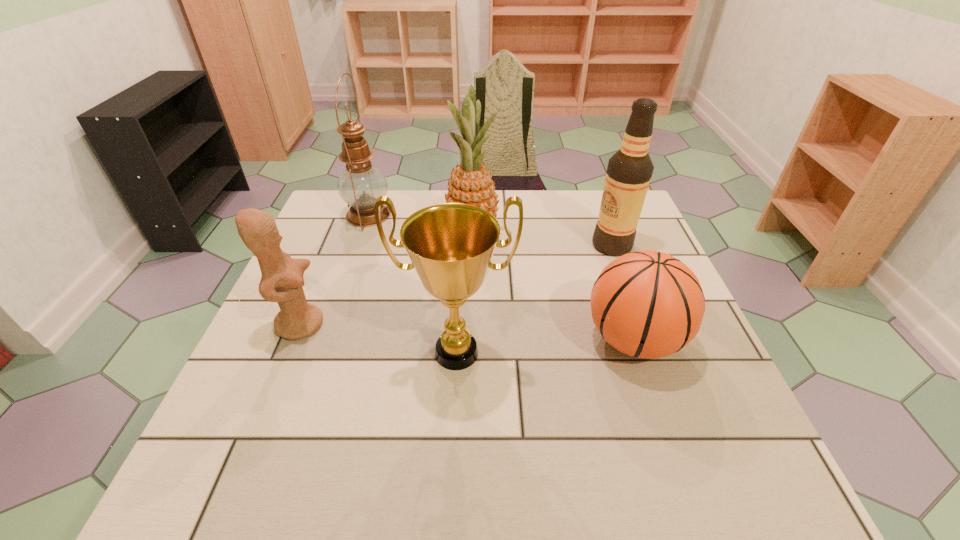
I want to click on vacant area that lies between the pineapple and the alcohol, so click(542, 239).

Locate an element on the screen. The height and width of the screenshot is (540, 960). blank region between the oil lamp and the shortest object is located at coordinates (501, 278).

In order to click on free space between the shortest object and the oil lamp in this screenshot , I will do `click(501, 278)`.

In order to click on unoccupied position between the alcohol and the pineapple in this screenshot , I will do `click(542, 239)`.

Locate an element on the screen. The width and height of the screenshot is (960, 540). object that ranks as the second closest to the figurine is located at coordinates (360, 184).

Choose which object is the second nearest neighbor to the oil lamp. Please provide its 2D coordinates. Your answer should be formatted as a tuple, i.e. [(x, y)], where the tuple contains the x and y coordinates of a point satisfying the conditions above.

[(282, 279)]

Where is `free space that satisfies the following two spatial constraints: 1. on the label of the alcohol; 2. on the front view with handles of the award`? The width and height of the screenshot is (960, 540). free space that satisfies the following two spatial constraints: 1. on the label of the alcohol; 2. on the front view with handles of the award is located at coordinates (652, 353).

Locate an element on the screen. The height and width of the screenshot is (540, 960). free space that satisfies the following two spatial constraints: 1. on the front-facing side of the second shortest object; 2. on the back side of the basketball is located at coordinates (294, 340).

At what (x,y) coordinates should I click in order to perform the action: click on free spot that satisfies the following two spatial constraints: 1. on the label of the alcohol; 2. on the front view with handles of the award. Please return your answer as a coordinate pair (x, y). This screenshot has height=540, width=960. Looking at the image, I should click on (652, 353).